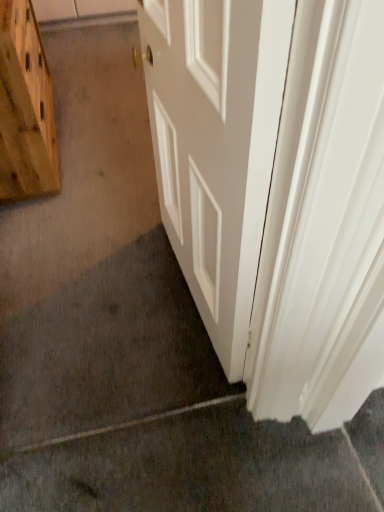
Question: Is point (382, 422) positioned closer to the camera than point (29, 113)?

Choices:
 (A) farther
 (B) closer

Answer: (B)

Question: In the image, is gray carpet at lower left positioned in front of or behind wooden cutting board at left?

Choices:
 (A) behind
 (B) front

Answer: (B)

Question: Which object is the farthest from the gray carpet at lower left?

Choices:
 (A) white smooth door at center
 (B) wooden cutting board at left

Answer: (B)

Question: Which is farther from the gray carpet at lower left?

Choices:
 (A) white smooth door at center
 (B) wooden cutting board at left

Answer: (B)